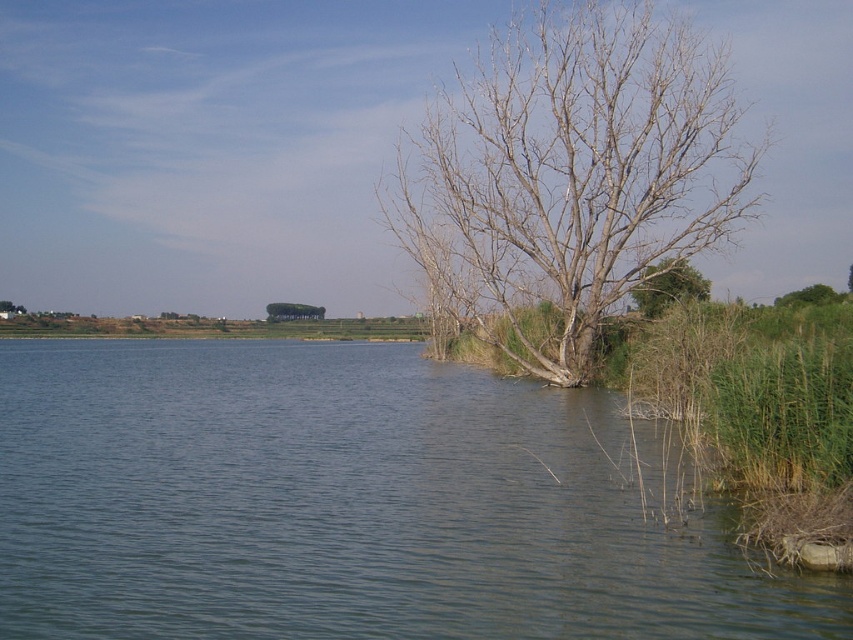
Question: Does greenish water at center have a smaller size compared to bare wood tree at center?

Choices:
 (A) yes
 (B) no

Answer: (A)

Question: Which object is the farthest from the green leafy tree at right?

Choices:
 (A) brown rough tree at upper right
 (B) green leafy tree at center

Answer: (B)

Question: Among these points, which one is nearest to the camera?

Choices:
 (A) (36, 339)
 (B) (784, 300)
 (C) (276, 314)

Answer: (B)

Question: Can you confirm if brown rough tree at upper right is positioned to the right of green leafy tree at right?

Choices:
 (A) no
 (B) yes

Answer: (A)

Question: Estimate the real-world distances between objects in this image. Which object is closer to the bare wood tree at center?

Choices:
 (A) brown rough tree at upper right
 (B) green leafy tree at center
 (C) greenish water at center
 (D) green leafy tree at right

Answer: (D)

Question: Is greenish water at center above green leafy tree at right?

Choices:
 (A) no
 (B) yes

Answer: (A)